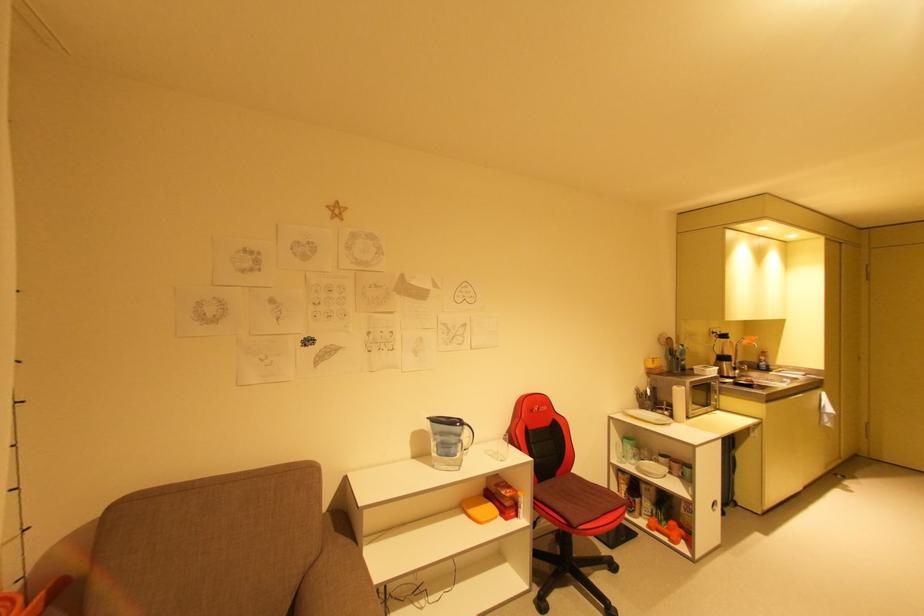
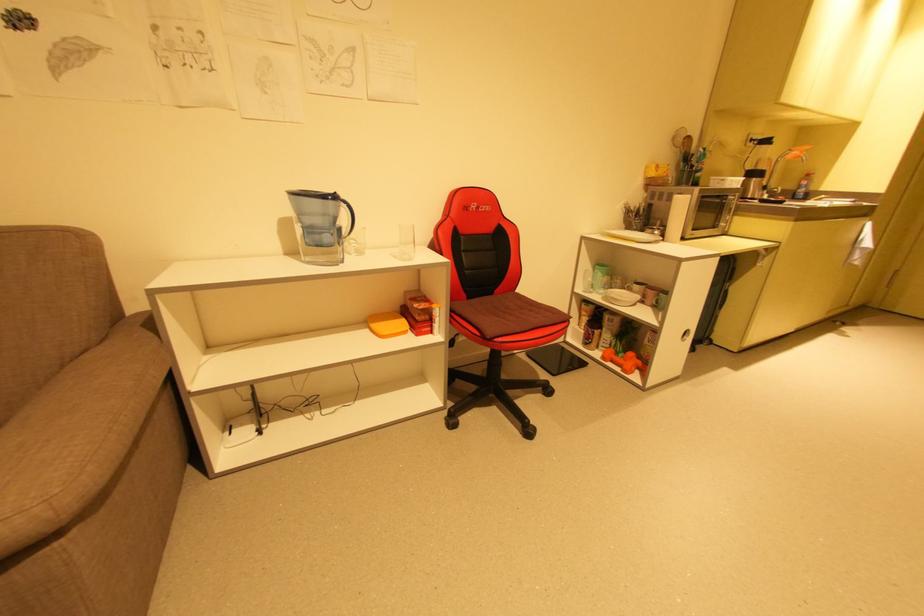
Question: The first image is from the beginning of the video and the second image is from the end. How did the camera likely rotate when shooting the video?

Choices:
 (A) Left
 (B) Right
 (C) Up
 (D) Down

Answer: (D)